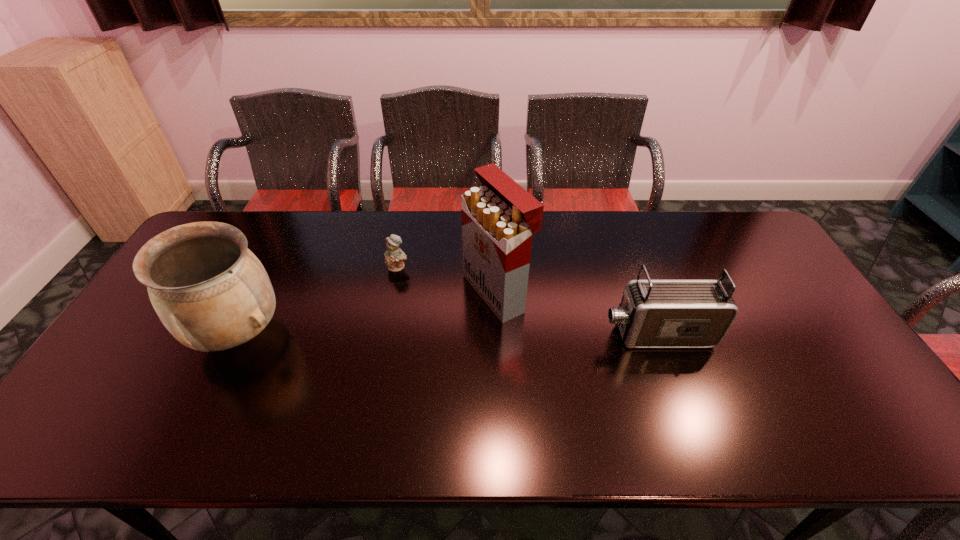
This screenshot has height=540, width=960. In order to click on vacant point at the near edge in this screenshot , I will do `click(536, 408)`.

At what (x,y) coordinates should I click in order to perform the action: click on free space at the left edge of the desktop. Please return your answer as a coordinate pair (x, y). Looking at the image, I should click on (171, 340).

In the image, there is a desktop. Identify the location of vacant space at the right edge. (754, 272).

Image resolution: width=960 pixels, height=540 pixels. In the image, there is a desktop. Identify the location of vacant space at the far right corner. (756, 239).

In the image, there is a desktop. Find the location of `vacant space at the near right corner`. vacant space at the near right corner is located at coordinates (857, 379).

Where is `free space between the tallest object and the shortest object`? This screenshot has height=540, width=960. free space between the tallest object and the shortest object is located at coordinates (447, 279).

Image resolution: width=960 pixels, height=540 pixels. I want to click on free space between the leftmost object and the third object from right to left, so click(x=318, y=300).

Locate an element on the screen. Image resolution: width=960 pixels, height=540 pixels. vacant point located between the teddy bear and the rightmost object is located at coordinates (527, 300).

This screenshot has height=540, width=960. In order to click on vacant region between the cigarette case and the shortest object in this screenshot , I will do `click(447, 279)`.

At what (x,y) coordinates should I click in order to perform the action: click on vacant region between the third tallest object and the third object from right to left. Please return your answer as a coordinate pair (x, y). This screenshot has width=960, height=540. Looking at the image, I should click on (527, 300).